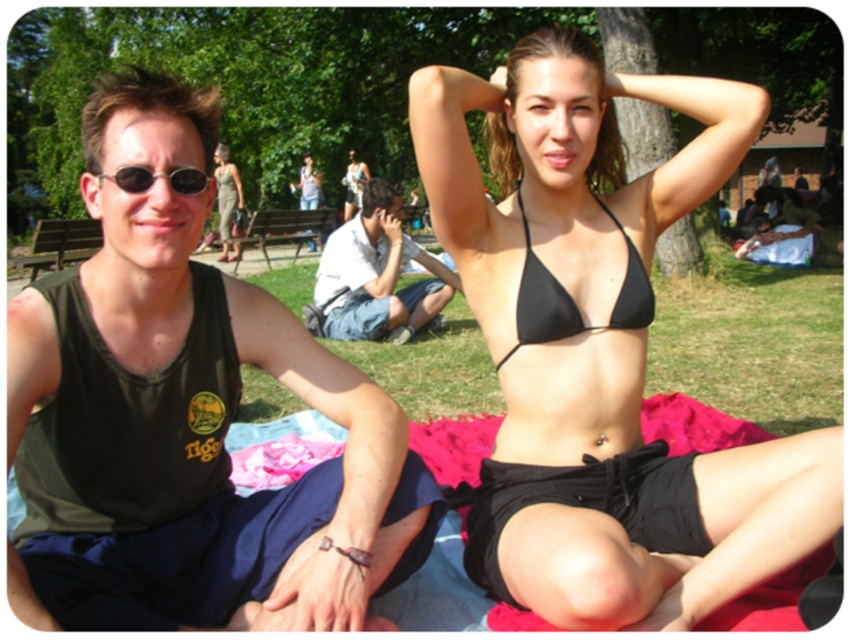
Is black matte bikini top at upper center smaller than sunglasses at left?

Incorrect, black matte bikini top at upper center is not smaller in size than sunglasses at left.

Can you confirm if black matte bikini top at upper center is positioned below sunglasses at left?

Yes.

Find the location of a particular element. This screenshot has width=852, height=640. black matte bikini top at upper center is located at coordinates (600, 348).

Which of these two, dark green tank top at left or white cotton shirt at center, stands shorter?

dark green tank top at left

Is dark green tank top at left shorter than white cotton shirt at center?

Correct, dark green tank top at left is not as tall as white cotton shirt at center.

Image resolution: width=852 pixels, height=640 pixels. I want to click on dark green tank top at left, so click(x=185, y=419).

This screenshot has width=852, height=640. I want to click on dark green tank top at left, so click(185, 419).

Between white cotton shirt at center and sunglasses at left, which one has more height?

white cotton shirt at center

What do you see at coordinates (377, 275) in the screenshot? This screenshot has width=852, height=640. I see `white cotton shirt at center` at bounding box center [377, 275].

This screenshot has width=852, height=640. What are the coordinates of `white cotton shirt at center` in the screenshot? It's located at (377, 275).